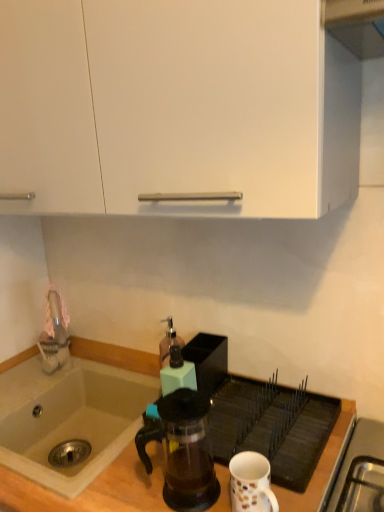
At what (x,y) coordinates should I click in order to perform the action: click on vacant area to the right of matte plastic soap dispenser at center, which is counted as the 1th kitchen appliance, starting from the front. Please return your answer as a coordinate pair (x, y). Looking at the image, I should click on (245, 409).